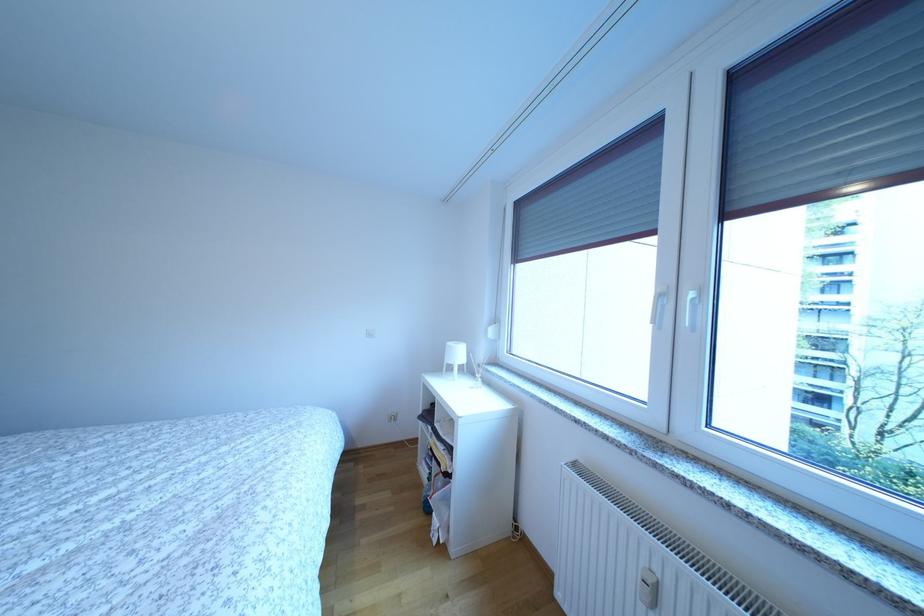
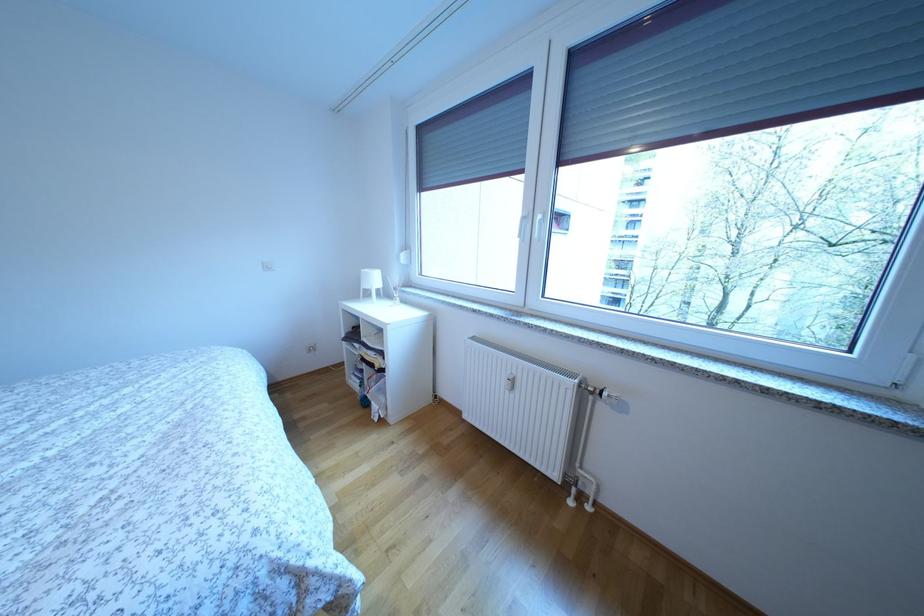
The point at (475, 377) is marked in the first image. Where is the corresponding point in the second image?

(392, 300)